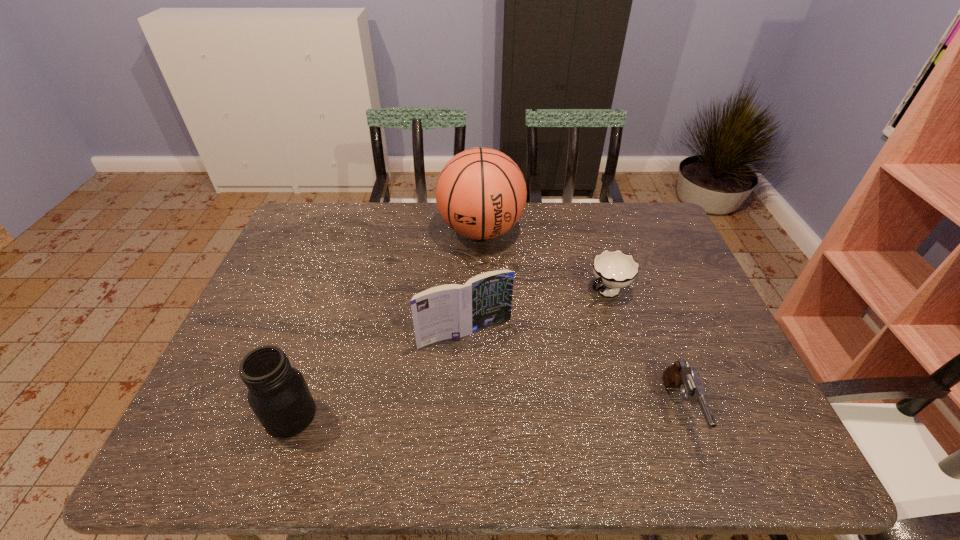
Locate an element on the screen. The width and height of the screenshot is (960, 540). vacant area between the book and the jar is located at coordinates (378, 374).

Where is `vacant region between the third nearest object and the second farthest object`? The height and width of the screenshot is (540, 960). vacant region between the third nearest object and the second farthest object is located at coordinates (537, 312).

At what (x,y) coordinates should I click in order to perform the action: click on unoccupied position between the fourth tallest object and the basketball. Please return your answer as a coordinate pair (x, y). This screenshot has width=960, height=540. Looking at the image, I should click on (581, 320).

This screenshot has width=960, height=540. In order to click on empty space between the leftmost object and the pistol in this screenshot , I will do tap(485, 413).

Where is `free space between the shortest object and the second shortest object`? free space between the shortest object and the second shortest object is located at coordinates click(x=643, y=350).

I want to click on free spot between the jar and the basketball, so click(x=386, y=323).

Find the location of a particular element. free space between the basketball and the shortest object is located at coordinates (544, 261).

Locate an element on the screen. empty location between the pistol and the jar is located at coordinates 485,413.

Locate an element on the screen. Image resolution: width=960 pixels, height=540 pixels. object that ranks as the second closest to the third nearest object is located at coordinates (278, 394).

Identify which object is the fourth nearest to the pistol. Please provide its 2D coordinates. Your answer should be formatted as a tuple, i.e. [(x, y)], where the tuple contains the x and y coordinates of a point satisfying the conditions above.

[(278, 394)]